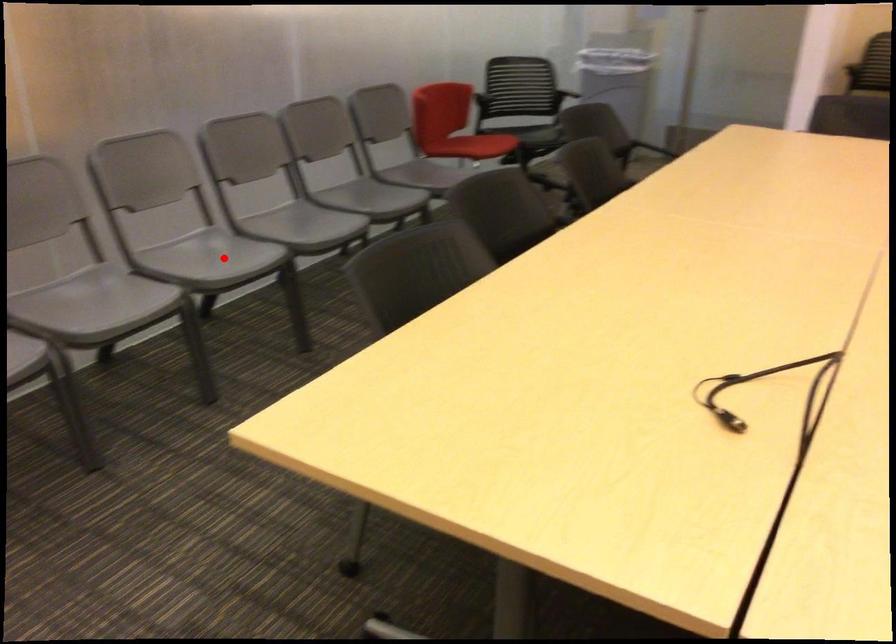
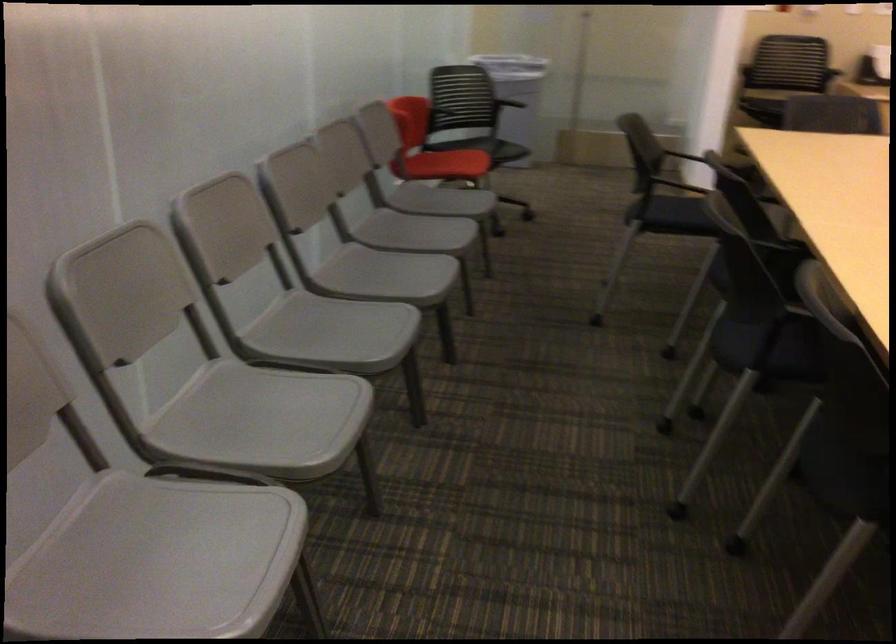
In the second image, find the point that corresponds to the highlighted location in the first image.

(332, 332)